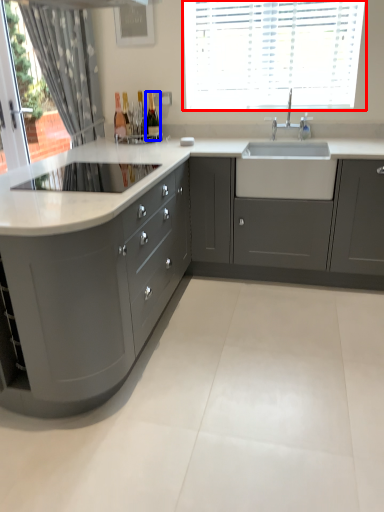
Question: Which point is further to the camera, window (highlighted by a red box) or bottle (highlighted by a blue box)?

Choices:
 (A) window
 (B) bottle

Answer: (B)